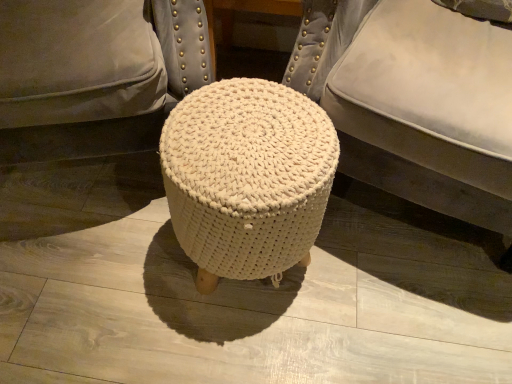
Identify the location of white knitted pouf at center. (404, 101).

What do you see at coordinates (404, 101) in the screenshot? This screenshot has height=384, width=512. I see `white knitted pouf at center` at bounding box center [404, 101].

Image resolution: width=512 pixels, height=384 pixels. What do you see at coordinates (247, 178) in the screenshot? I see `white knitted stool at center` at bounding box center [247, 178].

Where is `white knitted stool at center`? white knitted stool at center is located at coordinates (247, 178).

Where is `white knitted pouf at center`? Image resolution: width=512 pixels, height=384 pixels. white knitted pouf at center is located at coordinates (404, 101).

Consider the image. Visually, is white knitted stool at center positioned to the left or to the right of white knitted pouf at center?

white knitted stool at center is positioned on white knitted pouf at center's left side.

Is the position of white knitted stool at center more distant than that of white knitted pouf at center?

Yes, the depth of white knitted stool at center is greater than that of white knitted pouf at center.

Between point (287, 116) and point (490, 92), which one is positioned in front?

The point (490, 92) is in front.

From the image's perspective, is white knitted stool at center over white knitted pouf at center?

Actually, white knitted stool at center appears below white knitted pouf at center in the image.

From a real-world perspective, does white knitted stool at center sit lower than white knitted pouf at center?

Yes.

Is white knitted stool at center thinner than white knitted pouf at center?

Yes, white knitted stool at center is thinner than white knitted pouf at center.

Considering the sizes of objects white knitted stool at center and white knitted pouf at center in the image provided, who is taller, white knitted stool at center or white knitted pouf at center?

With more height is white knitted pouf at center.

Which of these two, white knitted stool at center or white knitted pouf at center, is bigger?

Bigger between the two is white knitted pouf at center.

Do you think white knitted stool at center is within white knitted pouf at center, or outside of it?

white knitted stool at center is located beyond the bounds of white knitted pouf at center.

Is white knitted stool at center beside white knitted pouf at center?

No, white knitted stool at center is not next to white knitted pouf at center.

Is white knitted stool at center facing away from white knitted pouf at center?

Yes, white knitted stool at center is positioned with its back facing white knitted pouf at center.

At what (x,y) coordinates should I click in order to perform the action: click on stool that appears on the left of white knitted pouf at center. Please return your answer as a coordinate pair (x, y). The height and width of the screenshot is (384, 512). Looking at the image, I should click on (247, 178).

Considering the relative positions of white knitted pouf at center and white knitted stool at center in the image provided, is white knitted pouf at center to the left or to the right of white knitted stool at center?

In the image, white knitted pouf at center appears on the right side of white knitted stool at center.

Is white knitted pouf at center in front of or behind white knitted stool at center in the image?

Clearly, white knitted pouf at center is in front of white knitted stool at center.

Which is less distant, (298,52) or (286,165)?

The point (286,165) is closer to the camera.

From the image's perspective, is white knitted pouf at center under white knitted stool at center?

No.

From a real-world perspective, who is located higher, white knitted pouf at center or white knitted stool at center?

white knitted pouf at center is physically above.

Can you confirm if white knitted pouf at center is thinner than white knitted stool at center?

Incorrect, the width of white knitted pouf at center is not less than that of white knitted stool at center.

Which of these two, white knitted pouf at center or white knitted stool at center, stands taller?

white knitted pouf at center.

Considering the relative sizes of white knitted pouf at center and white knitted stool at center in the image provided, is white knitted pouf at center bigger than white knitted stool at center?

Correct, white knitted pouf at center is larger in size than white knitted stool at center.

In the scene shown: Can we say white knitted pouf at center lies outside white knitted stool at center?

Absolutely, white knitted pouf at center is external to white knitted stool at center.

Is white knitted pouf at center in contact with white knitted stool at center?

No, white knitted pouf at center is not touching white knitted stool at center.

Is white knitted pouf at center positioned with its back to white knitted stool at center?

No, white knitted pouf at center is not facing away from white knitted stool at center.

What are the coordinates of `furniture on the right of white knitted stool at center` in the screenshot? It's located at (404, 101).

Where is `stool below the white knitted pouf at center (from a real-world perspective)`? This screenshot has width=512, height=384. stool below the white knitted pouf at center (from a real-world perspective) is located at coordinates (247, 178).

The image size is (512, 384). I want to click on stool located behind the white knitted pouf at center, so click(247, 178).